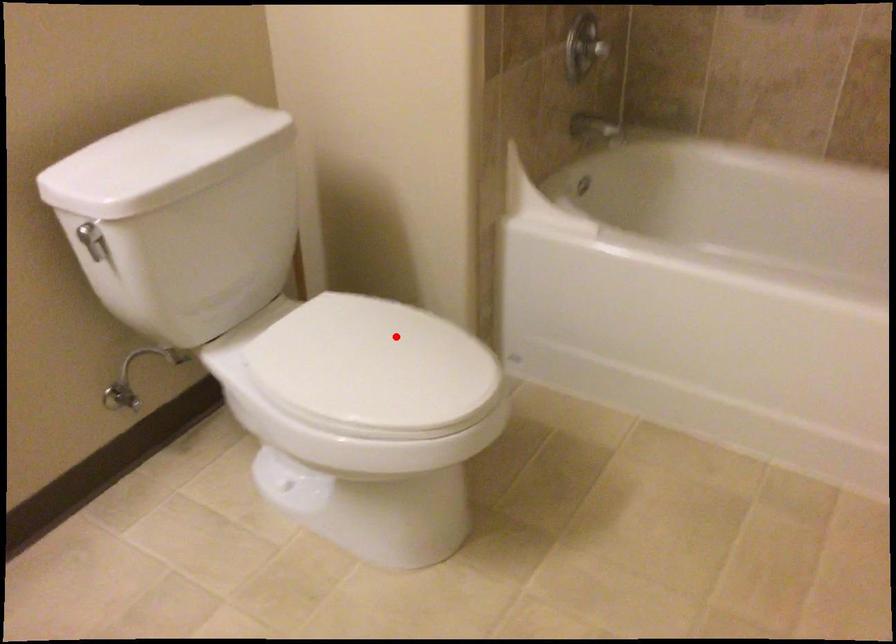
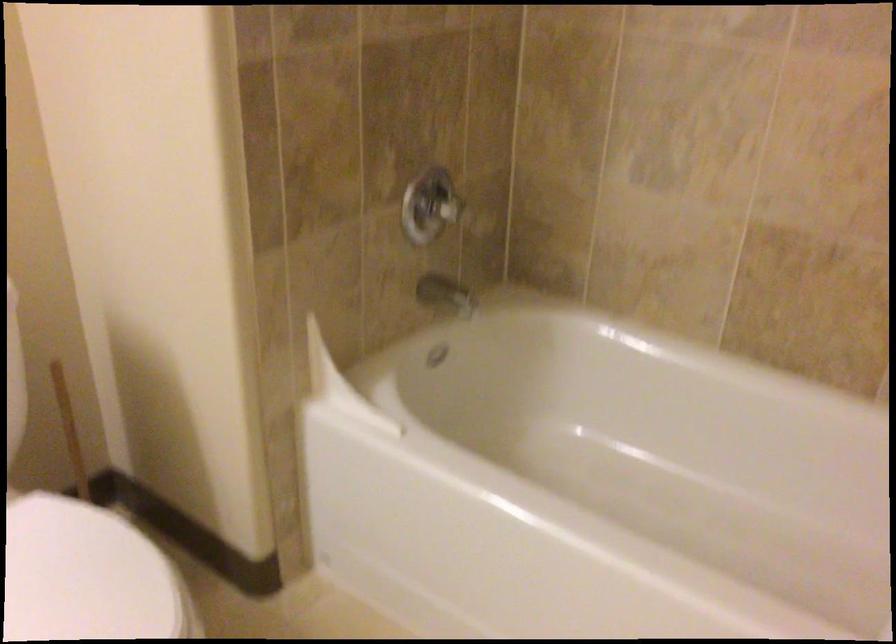
Question: I am providing you with two images of the same scene from different viewpoints. A red point is shown in image1. For the corresponding object point in image2, is it positioned nearer or farther from the camera?

Choices:
 (A) Nearer
 (B) Farther

Answer: (A)